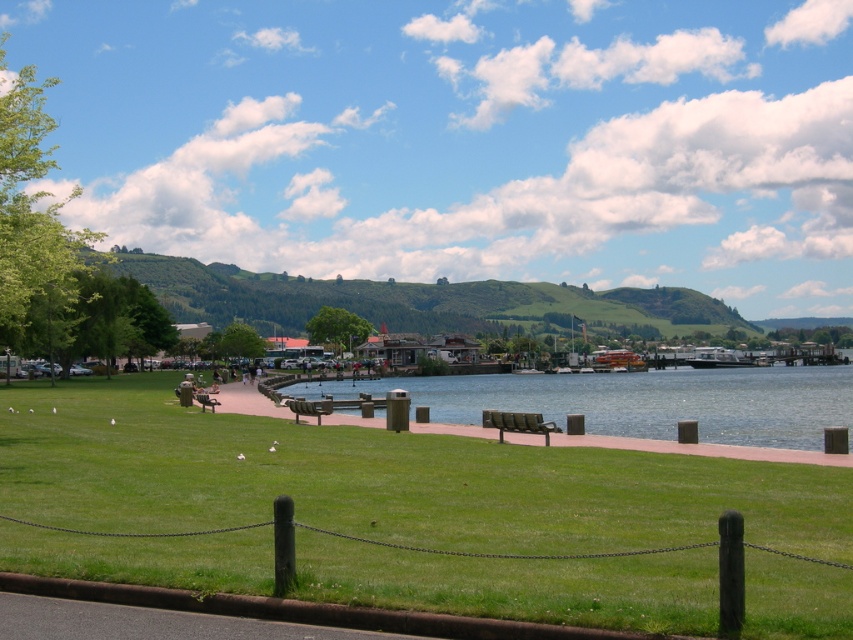
You are planning to place a 1.5 meter wide picnic basket on the bench. Which bench, the metallic green bench at center or the wooden bench at center, can accommodate the basket without overhanging?

The wooden bench at center can accommodate the picnic basket since it has a greater width than the metallic green bench at center.

You are a park visitor who wants to take a photo of the metallic gray boat at right while sitting on the metallic green bench at center. Will the bench block your view of the boat?

The metallic green bench at center is not as tall as the metallic gray boat at right, so the bench will not block your view of the boat.